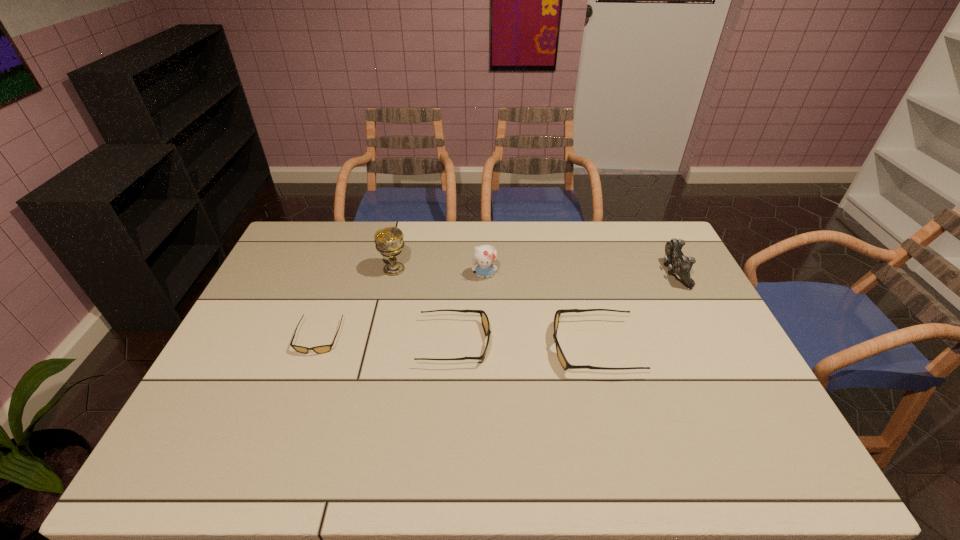
At what (x,y) coordinates should I click in order to perform the action: click on free space located on the front-facing side of the second sunglasses from right to left. Please return your answer as a coordinate pair (x, y). The height and width of the screenshot is (540, 960). Looking at the image, I should click on (615, 342).

I want to click on free spot located 0.320m on the front-facing side of the fifth object from left to right, so click(x=440, y=348).

What are the coordinates of `vacant space positioned on the front-facing side of the fifth object from left to right` in the screenshot? It's located at (523, 348).

I want to click on vacant point located on the front-facing side of the fifth object from left to right, so click(x=415, y=348).

Where is `free space located on the surface of the control with buttons`? This screenshot has width=960, height=540. free space located on the surface of the control with buttons is located at coordinates (646, 273).

Locate an element on the screen. This screenshot has width=960, height=540. vacant space positioned 0.120m on the surface of the control with buttons is located at coordinates (628, 273).

At what (x,y) coordinates should I click in order to perform the action: click on blank area located on the surface of the control with buttons. Please return your answer as a coordinate pair (x, y). This screenshot has width=960, height=540. Looking at the image, I should click on (593, 273).

Where is `vacant space situated on the front-facing side of the second tallest object`? The width and height of the screenshot is (960, 540). vacant space situated on the front-facing side of the second tallest object is located at coordinates (486, 361).

Identify the location of free space located on the right of the fifth object from right to left. This screenshot has height=540, width=960. (440, 269).

Where is `control situated at the far edge`? control situated at the far edge is located at coordinates (678, 263).